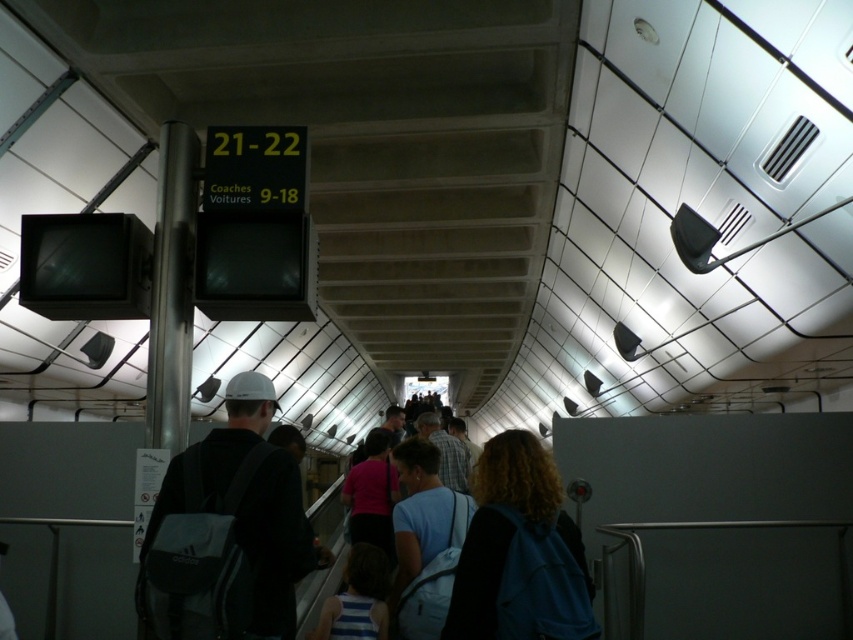
You are a security guard in the train station corridor. You need to check both the black fabric backpack at center and the blue backpack at center. Which backpack should you check first if you want to start with the larger one?

The black fabric backpack at center is larger in size than the blue backpack at center, so you should check the black fabric backpack at center first.

You are a person standing in the corridor and you see the black fabric backpack at center and the blue backpack at center. Which backpack is closer to the ground?

The black fabric backpack at center is positioned under the blue backpack at center, so it is closer to the ground.